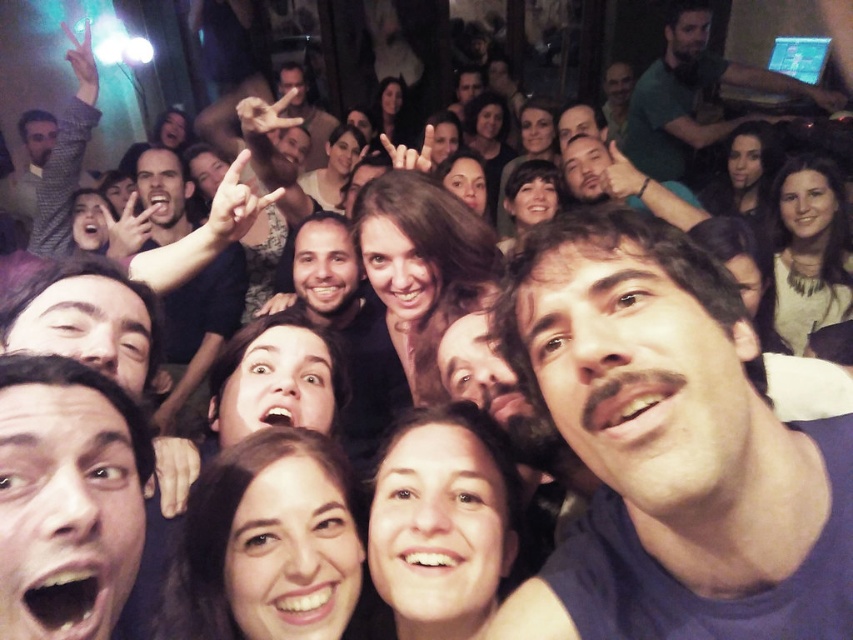
Does dark blue fabric at center have a larger size compared to green matte shirt at upper right?

Actually, dark blue fabric at center might be smaller than green matte shirt at upper right.

Does dark blue fabric at center appear over green matte shirt at upper right?

No, dark blue fabric at center is not above green matte shirt at upper right.

Is point (664, 429) less distant than point (698, 74)?

Yes, it is in front of point (698, 74).

Identify the location of dark blue fabric at center. (670, 448).

Does dark blue fabric at center appear under smooth skin face at lower left?

No, dark blue fabric at center is not below smooth skin face at lower left.

Is point (699, 492) positioned in front of point (7, 433)?

Yes, point (699, 492) is closer to viewer.

You are a GUI agent. You are given a task and a screenshot of the screen. Output one action in this format:
    pyautogui.click(x=<x>, y=<y>)
    Task: Click on the dark blue fabric at center
    Image resolution: width=853 pixels, height=640 pixels.
    Given the screenshot: What is the action you would take?
    pyautogui.click(x=670, y=448)

Can you confirm if smooth skin face at lower left is thinner than green matte shirt at upper right?

Yes, smooth skin face at lower left is thinner than green matte shirt at upper right.

The height and width of the screenshot is (640, 853). Describe the element at coordinates (67, 497) in the screenshot. I see `smooth skin face at lower left` at that location.

Does point (74, 364) come farther from viewer compared to point (712, 76)?

No, (74, 364) is closer to viewer.

The height and width of the screenshot is (640, 853). What are the coordinates of `smooth skin face at lower left` in the screenshot? It's located at (67, 497).